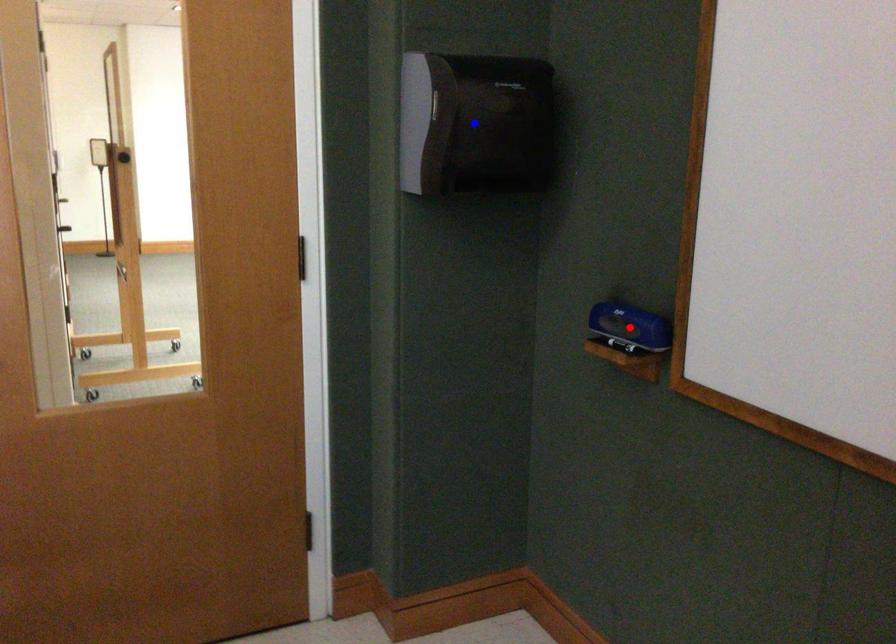
Question: In the image, two points are highlighted. Which point is nearer to the camera? Reply with the corresponding letter.

Choices:
 (A) blue point
 (B) red point

Answer: (B)